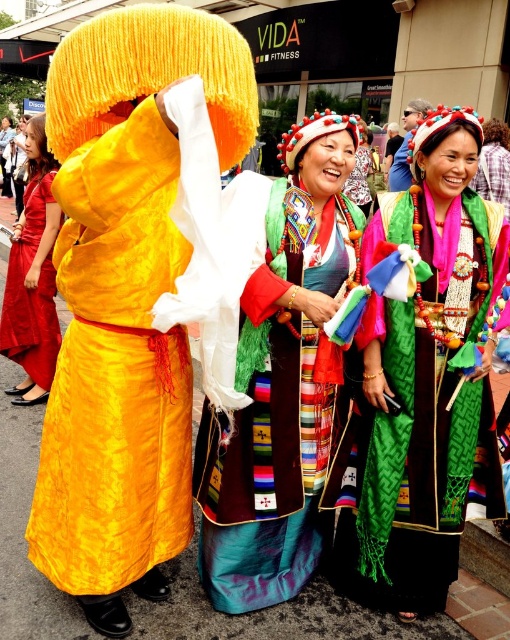
Is point (54, 380) positioned behind point (318, 412)?

Yes.

At what (x,y) coordinates should I click in order to perform the action: click on velvet yellow costume at left. Please return your answer as a coordinate pair (x, y). Looking at the image, I should click on (115, 371).

Can you confirm if green woven scarf at center is wider than matte red dress at left?

Yes.

What do you see at coordinates (428, 376) in the screenshot? The height and width of the screenshot is (640, 510). I see `green woven scarf at center` at bounding box center [428, 376].

This screenshot has width=510, height=640. In order to click on green woven scarf at center in this screenshot , I will do `click(428, 376)`.

This screenshot has height=640, width=510. I want to click on green woven scarf at center, so click(428, 376).

Who is shorter, embroidered silk dress at center or matte red dress at left?

Standing shorter between the two is embroidered silk dress at center.

Is point (252, 298) closer to viewer compared to point (36, 122)?

Yes, point (252, 298) is in front of point (36, 122).

Is point (330, 388) closer to viewer compared to point (5, 314)?

That is True.

I want to click on embroidered silk dress at center, so click(283, 381).